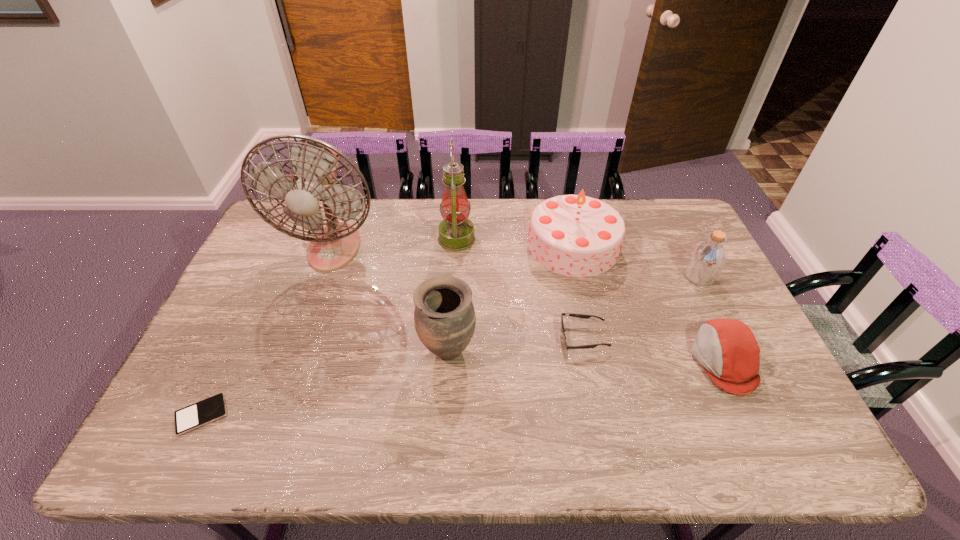
The height and width of the screenshot is (540, 960). What are the coordinates of `the tallest object` in the screenshot? It's located at (314, 163).

Identify the location of the second tallest object. (456, 232).

Where is `birthday cake`? birthday cake is located at coordinates (573, 235).

I want to click on urn, so click(444, 316).

Image resolution: width=960 pixels, height=540 pixels. Identify the location of the fifth tallest object. click(707, 260).

The height and width of the screenshot is (540, 960). What are the coordinates of `the third shortest object` in the screenshot? It's located at (729, 351).

Find the location of a particular element. The image size is (960, 540). the seventh tallest object is located at coordinates (583, 316).

Locate an element on the screen. iPod is located at coordinates (213, 408).

Find the location of a particular element. The height and width of the screenshot is (540, 960). vacant space located 0.200m in front of the tallest object to direct airflow is located at coordinates (306, 325).

This screenshot has height=540, width=960. I want to click on blank area located 0.080m on the front of the oil lamp, so click(455, 273).